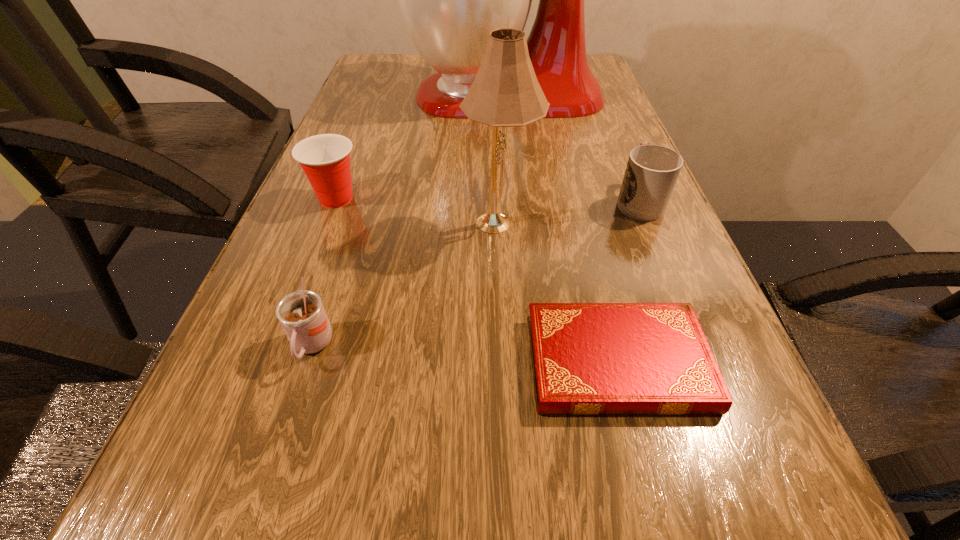
This screenshot has height=540, width=960. In order to click on the farthest object in this screenshot , I will do `click(450, 0)`.

Where is `mixer`? The image size is (960, 540). mixer is located at coordinates (450, 0).

Find the location of a particular element. the second tallest object is located at coordinates (505, 93).

Where is `the rightmost cup`? the rightmost cup is located at coordinates (652, 171).

Locate an element on the screen. the nearest cup is located at coordinates (301, 314).

Identify the location of hardback book. (587, 358).

Identify the location of vacant space located at the attachment hub of the mixer. The height and width of the screenshot is (540, 960). (368, 96).

Identify the location of free space located 0.140m at the attachment hub of the mixer. (357, 96).

At what (x,y) coordinates should I click in order to perform the action: click on free region located at the attachment hub of the mixer. Please return your answer as a coordinate pair (x, y). Looking at the image, I should click on (389, 96).

The image size is (960, 540). Find the location of `free space located on the left of the fifth shortest object`. free space located on the left of the fifth shortest object is located at coordinates (433, 221).